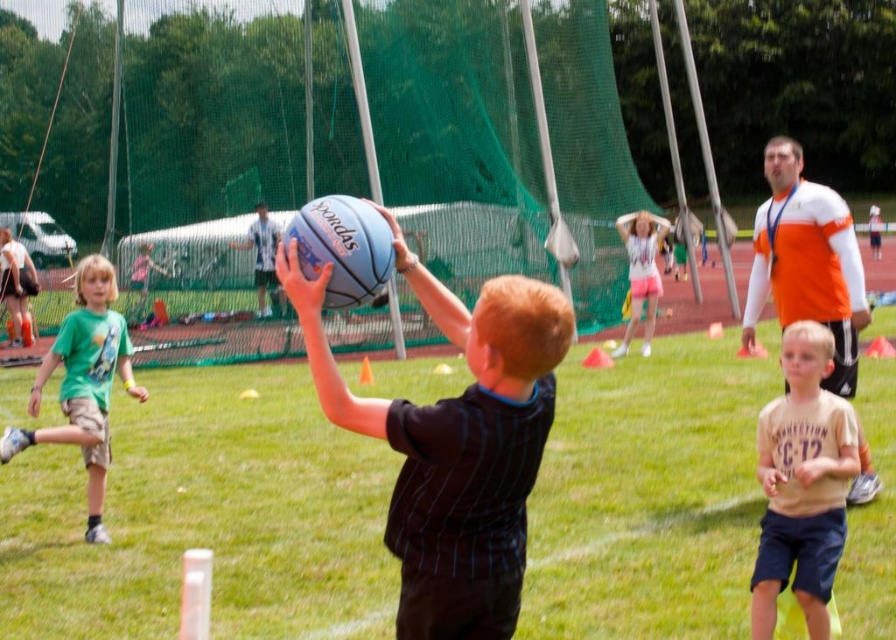
Question: Which point appears closest to the camera in this image?

Choices:
 (A) (83, 353)
 (B) (432, 493)

Answer: (B)

Question: Which point appears farthest from the camera in this image?

Choices:
 (A) (263, 212)
 (B) (840, 529)

Answer: (A)

Question: Which object is positioned farthest from the light brown cotton shirt at lower right?

Choices:
 (A) white striped shirt at center
 (B) orange jersey at center
 (C) blue rubber basketball at center

Answer: (A)

Question: From the image, what is the correct spatial relationship of blue rubber ball at center in relation to white striped shirt at center?

Choices:
 (A) below
 (B) above

Answer: (A)

Question: Does blue rubber basketball at center have a smaller size compared to green cotton shirt at left?

Choices:
 (A) no
 (B) yes

Answer: (B)

Question: Is blue rubber basketball at center smaller than orange jersey at center?

Choices:
 (A) no
 (B) yes

Answer: (B)